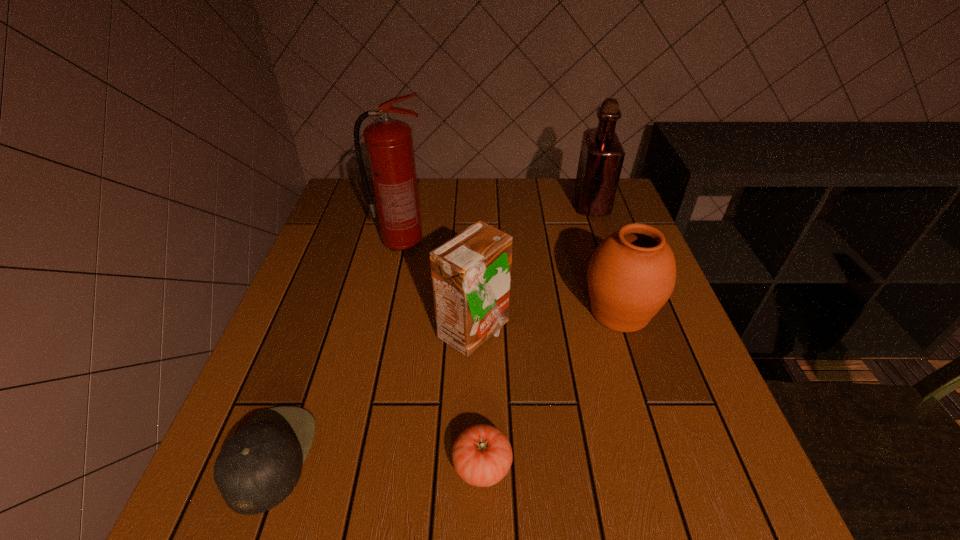
This screenshot has height=540, width=960. Find the location of `empty space that is in between the shortest object and the fifth object from right to left`. empty space that is in between the shortest object and the fifth object from right to left is located at coordinates (443, 354).

Where is `free space between the carton and the urn`? free space between the carton and the urn is located at coordinates [x=546, y=322].

Where is `empty space between the tomato and the carton`? This screenshot has height=540, width=960. empty space between the tomato and the carton is located at coordinates (478, 399).

This screenshot has height=540, width=960. In order to click on vacant area that lies between the fifth object from right to left and the second tallest object in this screenshot , I will do `click(496, 224)`.

What are the coordinates of `empty space between the fifth shortest object and the shortest object` in the screenshot? It's located at (537, 335).

At what (x,y) coordinates should I click in order to perform the action: click on free area in between the second object from left to right and the liquor. Please return your answer as a coordinate pair (x, y). This screenshot has height=540, width=960. Looking at the image, I should click on (496, 224).

Find the location of a particular element. blank region between the carton and the farthest object is located at coordinates (533, 268).

Find the location of `vacant space that is in between the shortest object and the second object from left to right`. vacant space that is in between the shortest object and the second object from left to right is located at coordinates (443, 354).

At what (x,y) coordinates should I click in order to perform the action: click on free area in between the carton and the leftmost object. Please return your answer as a coordinate pair (x, y). Looking at the image, I should click on (372, 395).

The width and height of the screenshot is (960, 540). Identify the location of object that is the fourth closest to the farthest object. (482, 455).